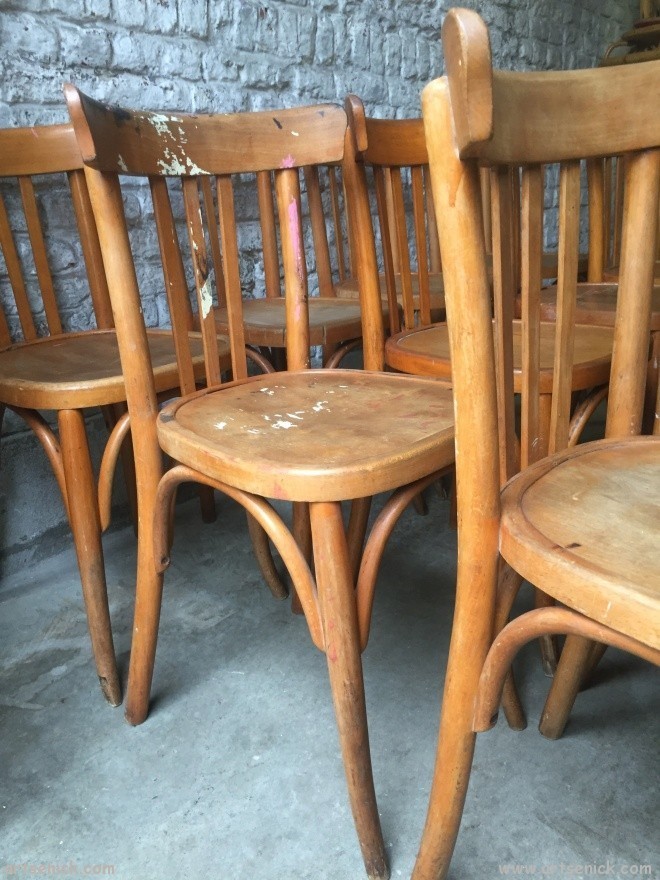
Find the location of a particular element. This screenshot has width=660, height=880. chairs is located at coordinates (61, 368), (288, 390), (317, 323), (429, 352), (412, 290), (597, 297), (603, 529).